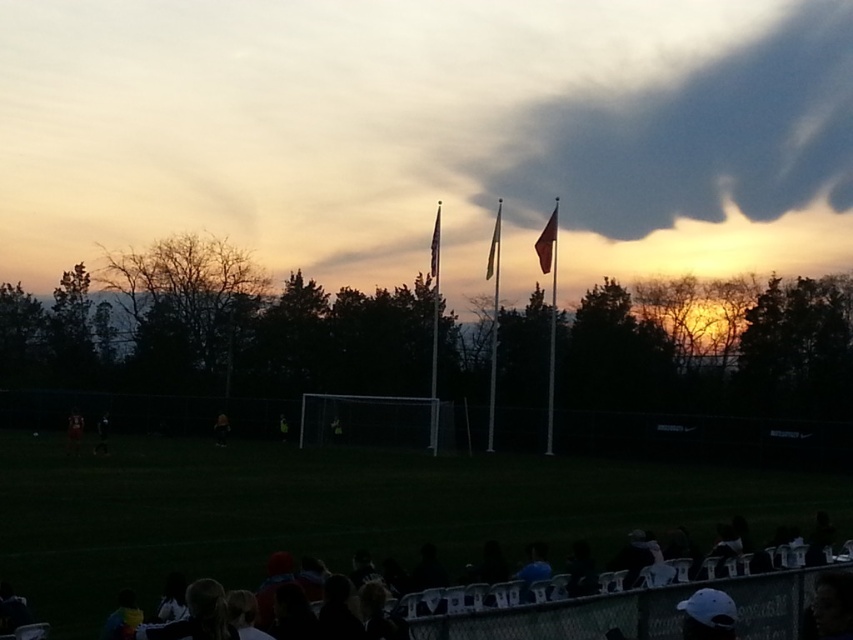
Between metallic flag pole at center and silky white flag at center, which one is positioned lower?

metallic flag pole at center is below.

Does point (549, 404) come farther from viewer compared to point (495, 241)?

No, (549, 404) is in front of (495, 241).

Who is more distant from viewer, (553,273) or (490,253)?

Positioned behind is point (490,253).

The image size is (853, 640). Find the location of `metallic flag pole at center`. metallic flag pole at center is located at coordinates (552, 336).

Who is shorter, white plastic chairs at lower center or green fabric flag pole at center?

Standing shorter between the two is white plastic chairs at lower center.

Can you confirm if white plastic chairs at lower center is taller than green fabric flag pole at center?

No, white plastic chairs at lower center is not taller than green fabric flag pole at center.

Does point (83, 602) lie in front of point (497, 317)?

Yes, point (83, 602) is closer to viewer.

Locate an element on the screen. The height and width of the screenshot is (640, 853). white plastic chairs at lower center is located at coordinates (233, 552).

Can you confirm if dark gray cloud at upper center is taller than silky white flag at center?

Yes, dark gray cloud at upper center is taller than silky white flag at center.

Looking at this image, does dark gray cloud at upper center appear under silky white flag at center?

Actually, dark gray cloud at upper center is above silky white flag at center.

Is point (755, 122) closer to camera compared to point (489, 246)?

No, it is not.

I want to click on dark gray cloud at upper center, so click(689, 134).